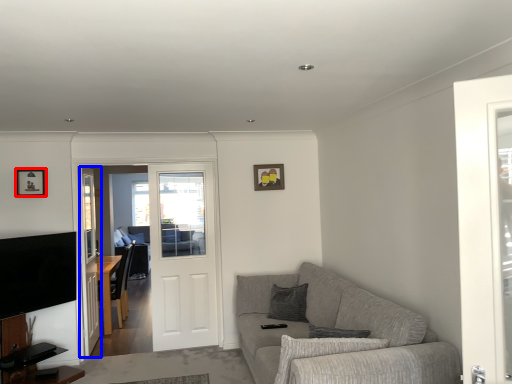
Question: Which point is closer to the camera, picture frame (highlighted by a red box) or screen door (highlighted by a blue box)?

Choices:
 (A) picture frame
 (B) screen door

Answer: (A)